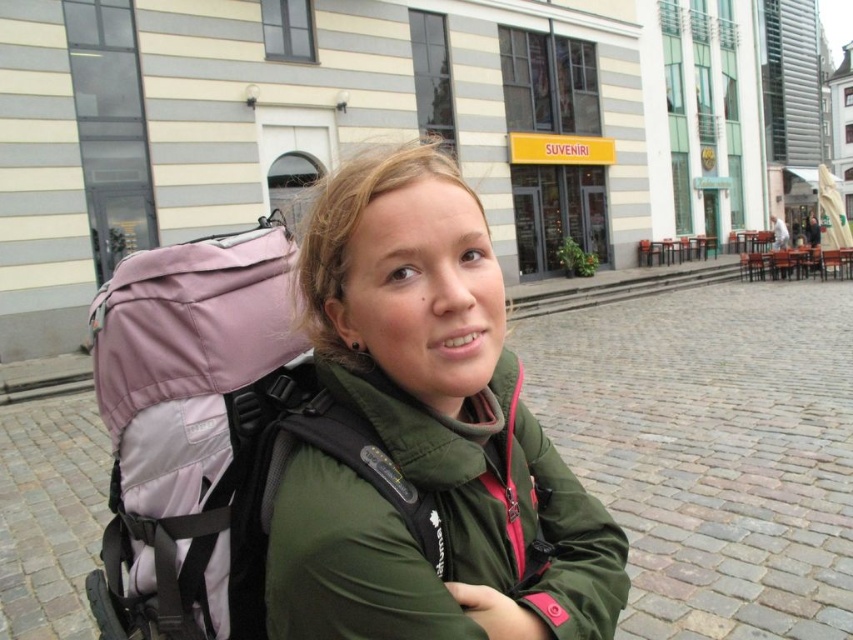
What is the 2D coordinate of the green matte jacket at center in the image?

The green matte jacket at center is located at the 2D coordinate point of (428, 435).

You are a photographer trying to capture the person in the scene. The green matte jacket at center and the pink fabric backpack at left are both in your viewfinder. Which object is closer to the camera based on their positions?

The green matte jacket at center is closer to the camera because it is in front of the pink fabric backpack at left.

Consider the image. You are a photographer capturing a scene of a traveler in a European city. You notice the green matte jacket at center and the pink fabric backpack at left. Which object is positioned higher in the image?

The green matte jacket at center is positioned higher than the pink fabric backpack at left in the image.